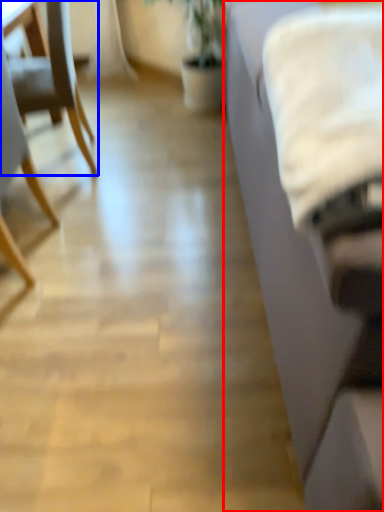
Question: Which object appears closest to the camera in this image, studio couch (highlighted by a red box) or chair (highlighted by a blue box)?

Choices:
 (A) studio couch
 (B) chair

Answer: (A)